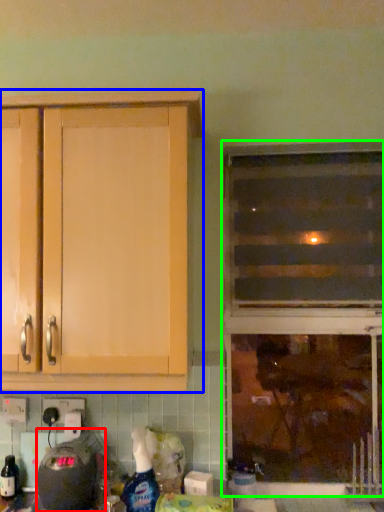
Question: Which object is positioned farthest from appliance (highlighted by a red box)? Select from cabinetry (highlighted by a blue box) and window (highlighted by a green box).

Choices:
 (A) cabinetry
 (B) window

Answer: (B)